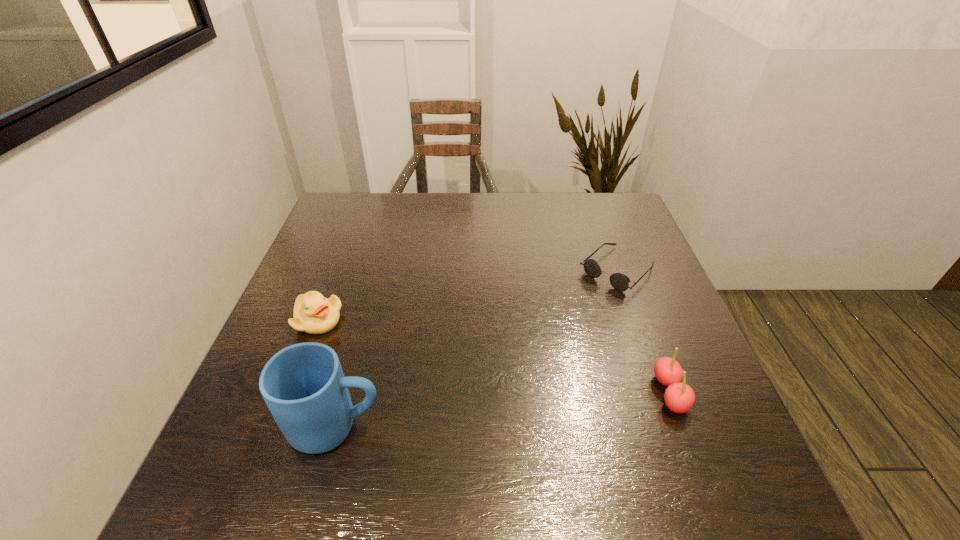
The width and height of the screenshot is (960, 540). In order to click on unoccupied area between the cherry and the third nearest object in this screenshot , I will do `click(494, 356)`.

In order to click on vacant area that lies between the third nearest object and the farthest object in this screenshot , I will do `click(468, 295)`.

Locate an element on the screen. The image size is (960, 540). vacant region between the tallest object and the cherry is located at coordinates (503, 410).

Find the location of a particular element. The image size is (960, 540). free point between the mug and the sunglasses is located at coordinates (477, 348).

The width and height of the screenshot is (960, 540). I want to click on empty location between the tallest object and the cherry, so click(x=503, y=410).

The width and height of the screenshot is (960, 540). Identify the location of vacant point located between the tallest object and the cherry. (503, 410).

The image size is (960, 540). I want to click on the closest object relative to the cherry, so point(619,281).

Find the location of a particular element. the second closest object to the cherry is located at coordinates (303, 385).

Identify the location of vacant area in the image that satisfies the following two spatial constraints: 1. on the front side of the duckling; 2. on the side of the mug with the handle. (277, 427).

Find the location of a particular element. This screenshot has width=960, height=540. vacant region that satisfies the following two spatial constraints: 1. on the front side of the duckling; 2. on the side of the tallest object with the handle is located at coordinates (277, 427).